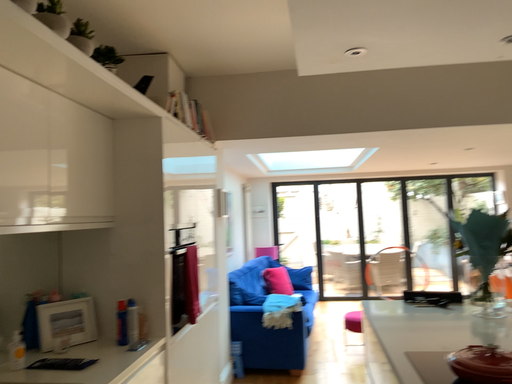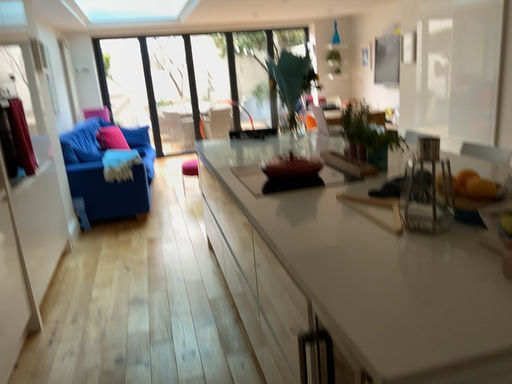
Question: How did the camera likely rotate when shooting the video?

Choices:
 (A) rotated upward
 (B) rotated downward

Answer: (B)